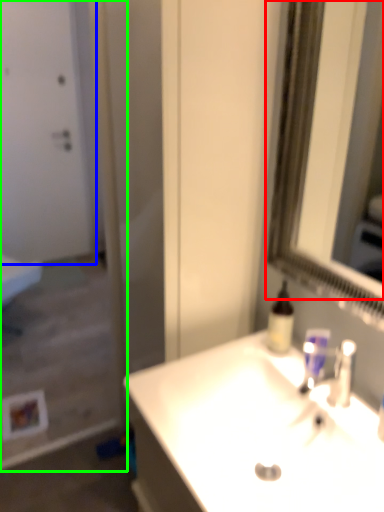
Question: Which object is the closest to the mirror (highlighted by a red box)? Choose among these: door (highlighted by a blue box) or screen door (highlighted by a green box).

Choices:
 (A) door
 (B) screen door

Answer: (B)